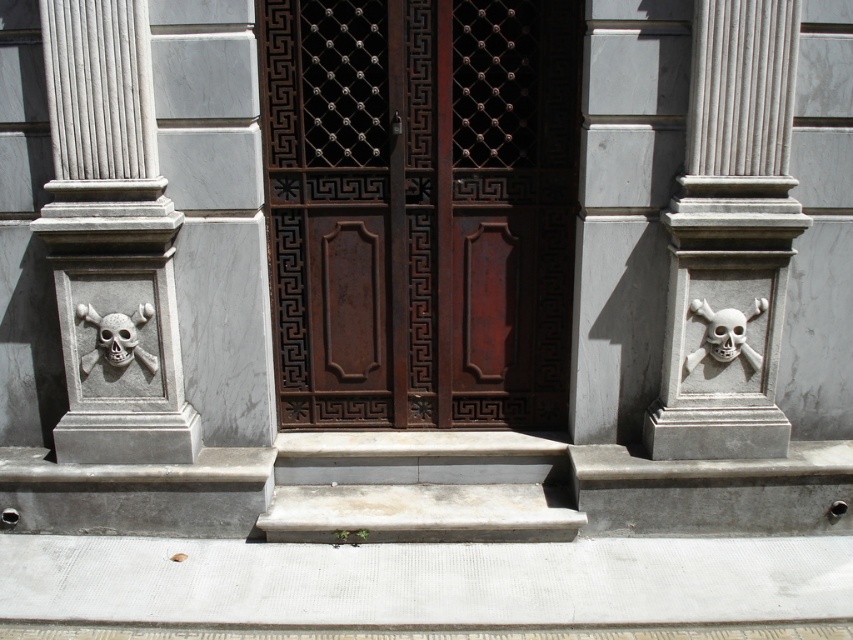
You are standing at the entrance of the building and want to ascend the white concrete stairs at center. Is the white matte skull at lower left above or below the stairs?

The white concrete stairs at center is positioned under the white matte skull at lower left, so the skull is above the stairs.

You are an architect examining the building facade. You notice two skulls on the columns. Which skull, the gray stone skull at center or the white matte skull at right, is closer to you?

The gray stone skull at center is closer to you because it is in front of the white matte skull at right.